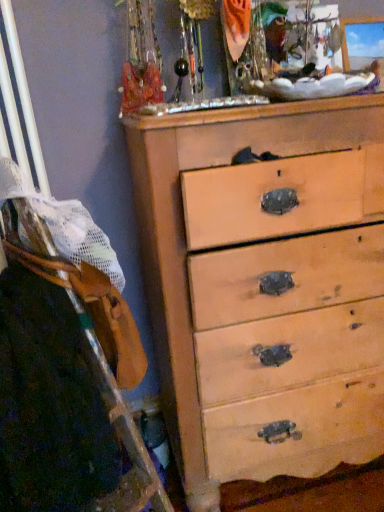
Image resolution: width=384 pixels, height=512 pixels. What do you see at coordinates (184, 230) in the screenshot?
I see `light wood chest of drawers at center` at bounding box center [184, 230].

In order to face light wood chest of drawers at center, should I rotate leftwards or rightwards?

To align with it, rotate right about 15.709°.

This screenshot has width=384, height=512. In order to click on light wood chest of drawers at center in this screenshot , I will do `click(184, 230)`.

Identify the location of wooden ladder at left. This screenshot has width=384, height=512. (66, 364).

The height and width of the screenshot is (512, 384). What do you see at coordinates (66, 364) in the screenshot?
I see `wooden ladder at left` at bounding box center [66, 364].

Locate an element on the screen. light wood chest of drawers at center is located at coordinates (184, 230).

Which is more to the left, wooden ladder at left or light wood chest of drawers at center?

From the viewer's perspective, wooden ladder at left appears more on the left side.

In the image, is wooden ladder at left positioned in front of or behind light wood chest of drawers at center?

wooden ladder at left is positioned closer to the viewer than light wood chest of drawers at center.

Which is less distant, (x=32, y=484) or (x=161, y=172)?

Point (x=32, y=484) is closer to the camera than point (x=161, y=172).

Consider the image. From the image's perspective, would you say wooden ladder at left is positioned over light wood chest of drawers at center?

No.

From a real-world perspective, is wooden ladder at left physically located above or below light wood chest of drawers at center?

In terms of real-world spatial position, wooden ladder at left is above light wood chest of drawers at center.

Does wooden ladder at left have a lesser width compared to light wood chest of drawers at center?

Correct, the width of wooden ladder at left is less than that of light wood chest of drawers at center.

Can you confirm if wooden ladder at left is taller than light wood chest of drawers at center?

No, wooden ladder at left is not taller than light wood chest of drawers at center.

Considering the sizes of wooden ladder at left and light wood chest of drawers at center in the image, is wooden ladder at left bigger or smaller than light wood chest of drawers at center?

Considering their sizes, wooden ladder at left takes up less space than light wood chest of drawers at center.

From the picture: Choose the correct answer: Is wooden ladder at left inside light wood chest of drawers at center or outside it?

wooden ladder at left is not enclosed by light wood chest of drawers at center.

Is wooden ladder at left not close to light wood chest of drawers at center?

wooden ladder at left is actually quite close to light wood chest of drawers at center.

Is wooden ladder at left aimed at light wood chest of drawers at center?

No, wooden ladder at left is not facing towards light wood chest of drawers at center.

Can you tell me how much wooden ladder at left and light wood chest of drawers at center differ in facing direction?

The angular difference between wooden ladder at left and light wood chest of drawers at center is 27.7 degrees.

Locate an element on the screen. ladder that is on the left side of light wood chest of drawers at center is located at coordinates 66,364.

Considering the positions of objects light wood chest of drawers at center and wooden ladder at left in the image provided, who is more to the left, light wood chest of drawers at center or wooden ladder at left?

wooden ladder at left.

Considering their positions, is light wood chest of drawers at center located in front of or behind wooden ladder at left?

In the image, light wood chest of drawers at center appears behind wooden ladder at left.

Considering the positions of point (177, 221) and point (111, 278), is point (177, 221) closer or farther from the camera than point (111, 278)?

Point (177, 221) is farther from the camera than point (111, 278).

From the image's perspective, which is below, light wood chest of drawers at center or wooden ladder at left?

From the image's view, wooden ladder at left is below.

From a real-world perspective, between light wood chest of drawers at center and wooden ladder at left, who is vertically higher?

wooden ladder at left.

Does light wood chest of drawers at center have a greater width compared to wooden ladder at left?

Yes.

Is light wood chest of drawers at center taller than wooden ladder at left?

Indeed, light wood chest of drawers at center has a greater height compared to wooden ladder at left.

Between light wood chest of drawers at center and wooden ladder at left, which one has smaller size?

wooden ladder at left is smaller.

Is light wood chest of drawers at center situated inside wooden ladder at left or outside?

light wood chest of drawers at center lies outside wooden ladder at left.

In the scene shown: Would you consider light wood chest of drawers at center to be distant from wooden ladder at left?

No, light wood chest of drawers at center is not far from wooden ladder at left.

Is wooden ladder at left at the back of light wood chest of drawers at center?

light wood chest of drawers at center does not have its back to wooden ladder at left.

The image size is (384, 512). Find the location of `the chest of drawers lying above the wooden ladder at left (from the image's perspective)`. the chest of drawers lying above the wooden ladder at left (from the image's perspective) is located at coordinates (184, 230).

Locate an element on the screen. This screenshot has height=512, width=384. chest of drawers below the wooden ladder at left (from a real-world perspective) is located at coordinates (184, 230).

Image resolution: width=384 pixels, height=512 pixels. Find the location of `chest of drawers on the right of wooden ladder at left`. chest of drawers on the right of wooden ladder at left is located at coordinates (184, 230).